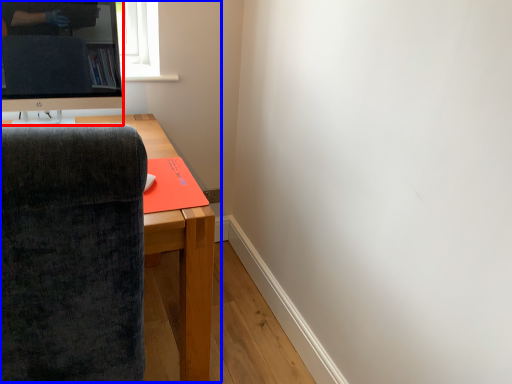
Question: Among these objects, which one is farthest to the camera, television (highlighted by a red box) or entertainment center (highlighted by a blue box)?

Choices:
 (A) television
 (B) entertainment center

Answer: (A)